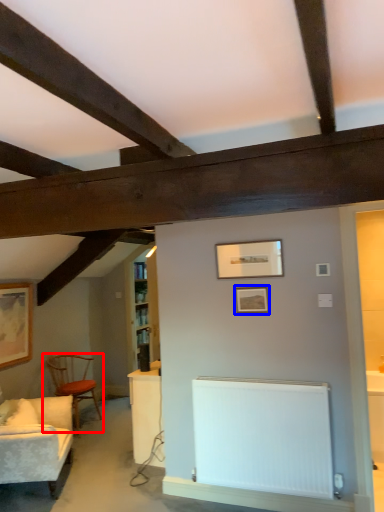
Question: Which object is closer to the camera taking this photo, chair (highlighted by a red box) or picture frame (highlighted by a blue box)?

Choices:
 (A) chair
 (B) picture frame

Answer: (B)